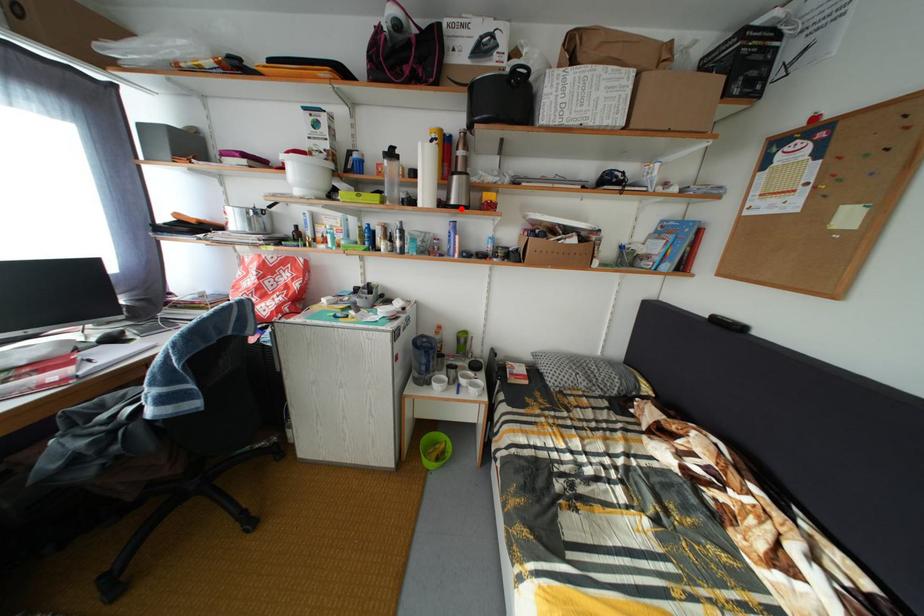
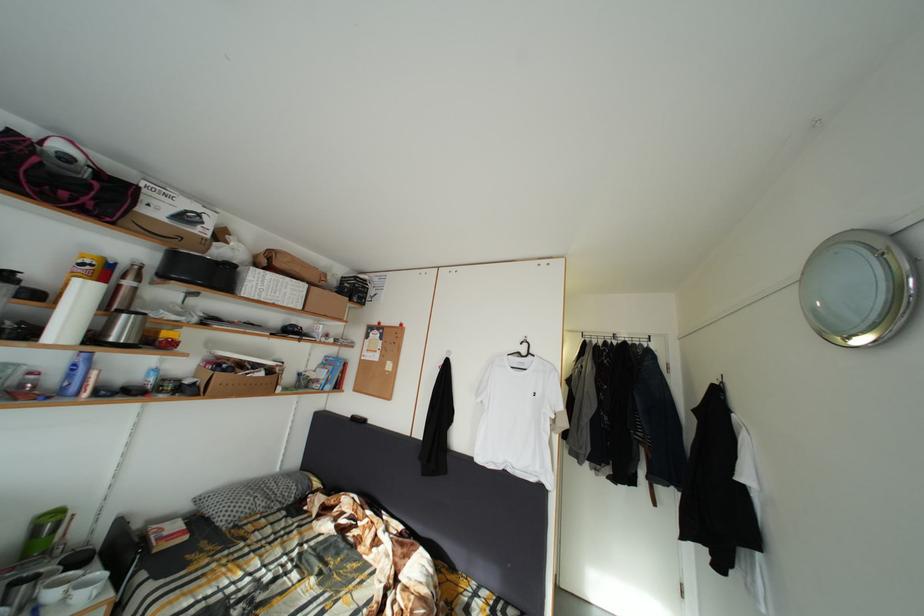
Where in the second image is the point corresponding to the highlighted location from the first image?

(120, 345)